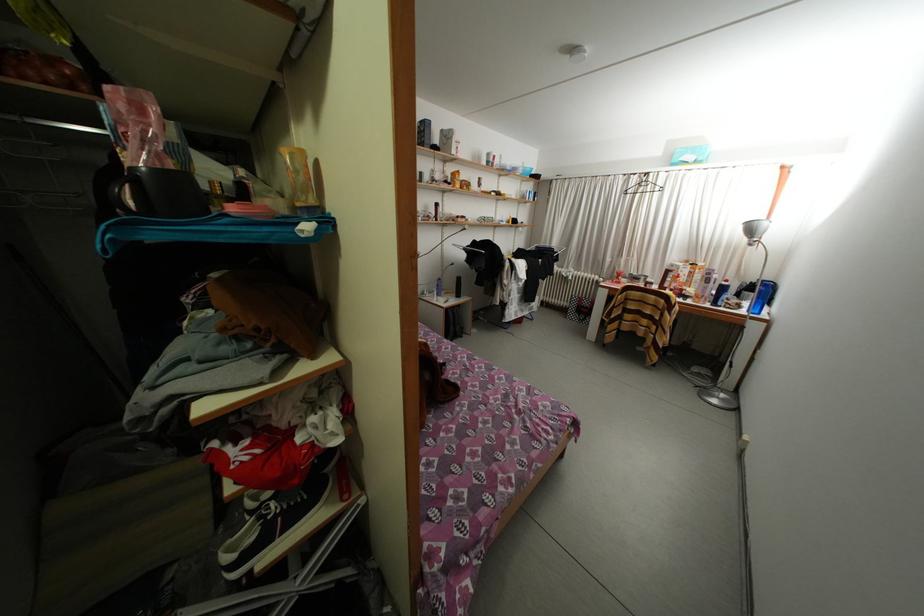
Find where to sit the chair sitting surface. Please return your answer as a coordinate pair (x, y).

(658, 342)